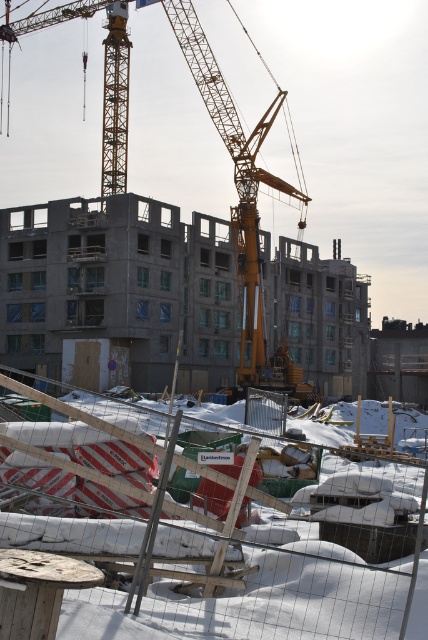
From the picture: You are a construction worker standing at the base of the building and looking towards the middle ground. You notice two points marked on the construction site. Which point, point (342, 516) or point (262, 369), is closer to you?

Point (342, 516) is in front of point (262, 369), so it is closer to you.

You are a construction worker standing at the edge of the construction site. You need to move a heavy tool from the white plastic fencing at lower center to the yellow metallic crane at center. Considering their positions, which object will you encounter first while moving the tool towards the crane?

The white plastic fencing at lower center is closer to the viewer than the yellow metallic crane at center, so you will encounter the white plastic fencing at lower center first before reaching the yellow metallic crane at center.